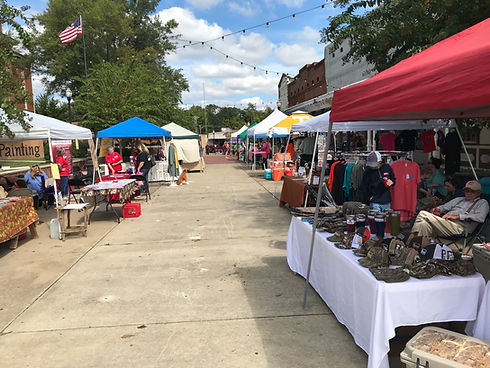
Where is `table cloth`? This screenshot has height=368, width=490. table cloth is located at coordinates (364, 297).